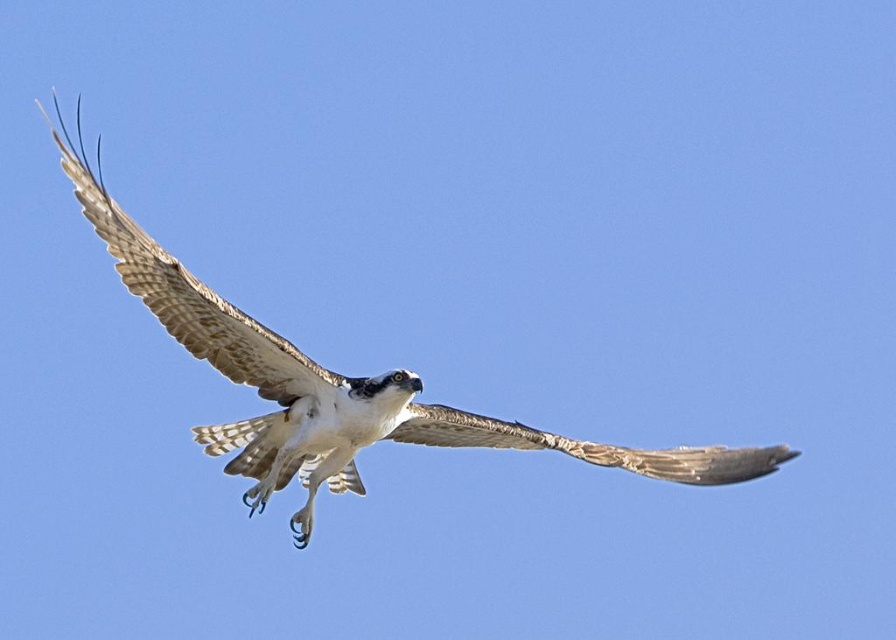
You are an ornithologist observing an osprey in flight. You notice the white feathered bird at center and the brown textured wing at upper left. Which object is bigger in size?

The white feathered bird at center is larger in size than the brown textured wing at upper left.

You are an ornithologist observing an osprey in flight. You notice the white feathered bird at center and the brown textured wing at center. Which object is bigger in size?

The white feathered bird at center is larger in size compared to the brown textured wing at center according to the description.

You are a photographer standing at a distance and want to capture the white feathered bird at center in your shot. If your camera has a maximum zoom range of 45 meters, will you be able to get a clear closeup of the bird?

The white feathered bird at center is 46.47 meters away, which exceeds the camera maximum zoom range of 45 meters. Therefore, you won not be able to get a clear closeup of the bird.